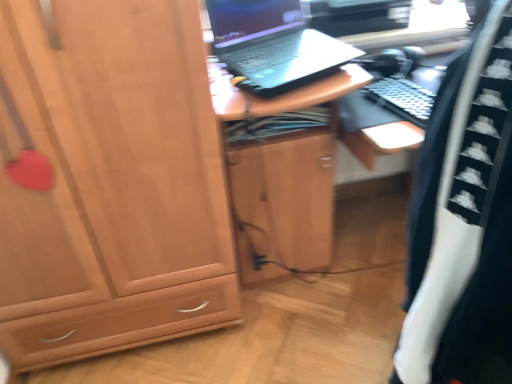
Question: Considering the relative sizes of matte wood cabinet at left and black matte laptop at upper center in the image provided, is matte wood cabinet at left bigger than black matte laptop at upper center?

Choices:
 (A) yes
 (B) no

Answer: (A)

Question: From a real-world perspective, does matte wood cabinet at left stand above black matte laptop at upper center?

Choices:
 (A) yes
 (B) no

Answer: (B)

Question: Considering the relative sizes of matte wood cabinet at left and black matte laptop at upper center in the image provided, is matte wood cabinet at left shorter than black matte laptop at upper center?

Choices:
 (A) yes
 (B) no

Answer: (B)

Question: Is the position of matte wood cabinet at left less distant than that of black matte laptop at upper center?

Choices:
 (A) no
 (B) yes

Answer: (B)

Question: Is matte wood cabinet at left smaller than black matte laptop at upper center?

Choices:
 (A) yes
 (B) no

Answer: (B)

Question: Is matte wood cabinet at left further to the viewer compared to black matte laptop at upper center?

Choices:
 (A) yes
 (B) no

Answer: (B)

Question: Does black matte laptop at upper center appear on the left side of black/white fabric at right?

Choices:
 (A) yes
 (B) no

Answer: (A)

Question: Is black/white fabric at right completely or partially inside black matte laptop at upper center?

Choices:
 (A) yes
 (B) no

Answer: (B)

Question: Could you tell me if black matte laptop at upper center is facing black/white fabric at right?

Choices:
 (A) no
 (B) yes

Answer: (B)

Question: Is black matte laptop at upper center thinner than black/white fabric at right?

Choices:
 (A) no
 (B) yes

Answer: (A)

Question: Is black matte laptop at upper center to the right of black/white fabric at right from the viewer's perspective?

Choices:
 (A) no
 (B) yes

Answer: (A)

Question: Does black matte laptop at upper center have a larger size compared to black/white fabric at right?

Choices:
 (A) yes
 (B) no

Answer: (B)

Question: From the image's perspective, is matte wood cabinet at left beneath black/white fabric at right?

Choices:
 (A) no
 (B) yes

Answer: (A)